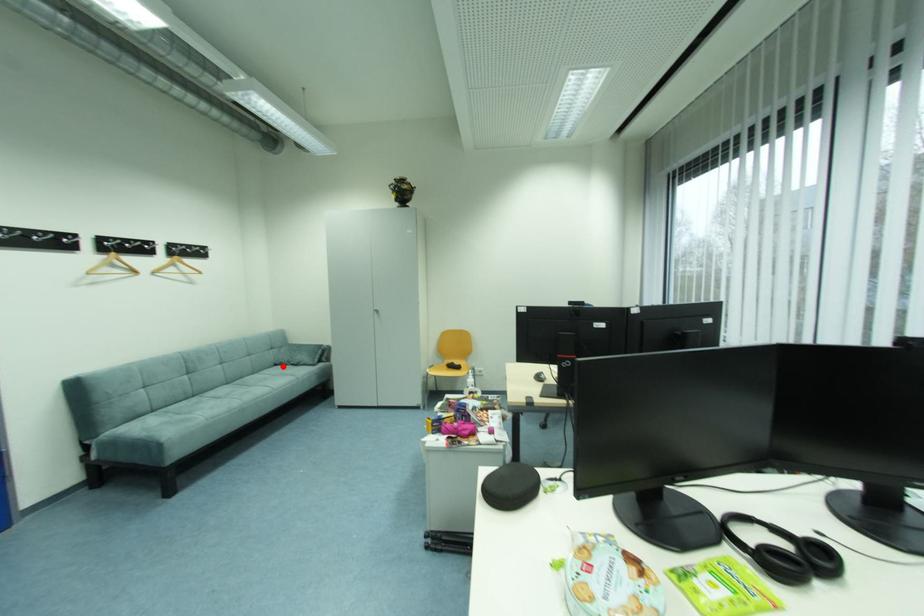
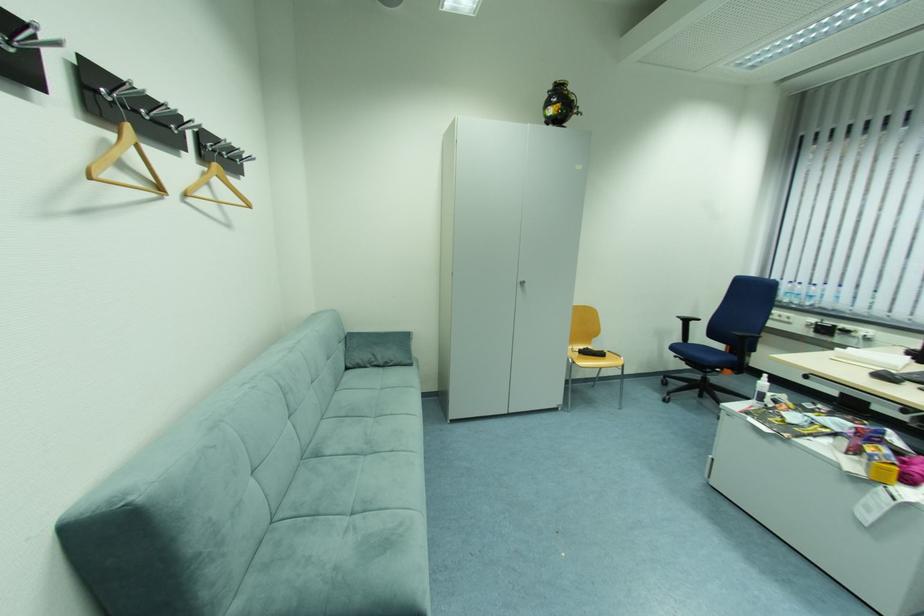
The point at the highlighted location is marked in the first image. Where is the corresponding point in the second image?

(354, 370)